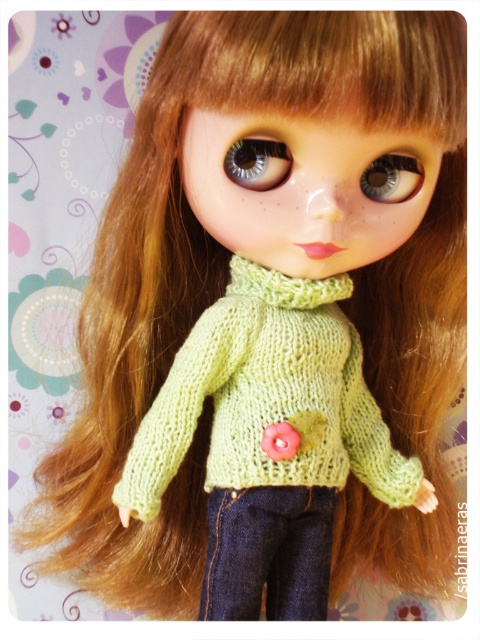
You are a child trying to see the doll clearly. The shiny silver eye at center and the green knitted scarf at center are in the way. Which object is blocking your view of the other?

The shiny silver eye at center is behind the green knitted scarf at center, so the green knitted scarf at center is blocking the view of the shiny silver eye at center.

You are a photographer trying to capture the perfect shot of the doll. The camera is positioned at the center of the image. To ensure the green knitted scarf at center is in focus, where should you aim the camera? Use the coordinates provided in the description to answer.

The green knitted scarf at center is located at coordinates point (285, 285), so aim the camera at that point to focus on the scarf.